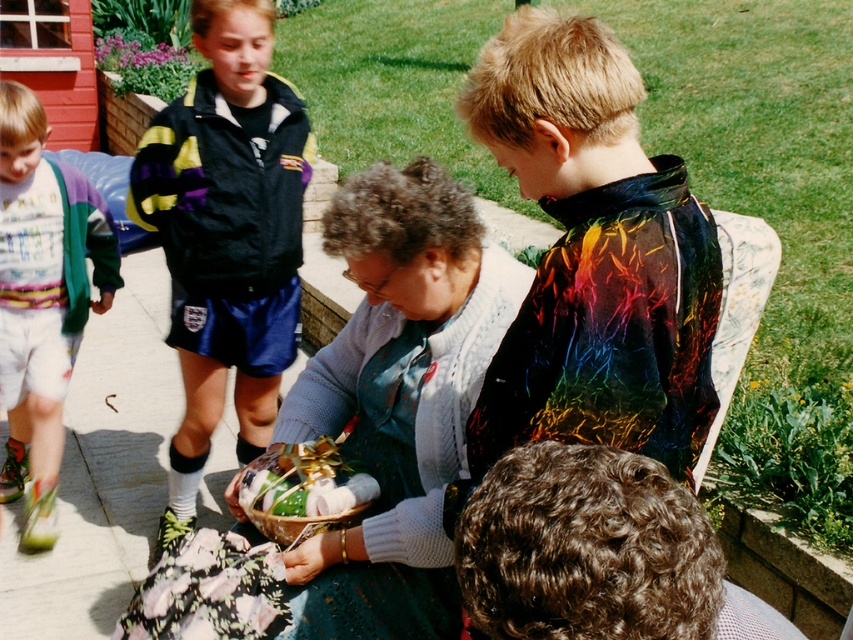
Is black jacket at upper left closer to camera compared to shiny metallic bowl at center?

No, black jacket at upper left is further to the viewer.

Which is above, black jacket at upper left or shiny metallic bowl at center?

black jacket at upper left is higher up.

Who is more distant from viewer, [173,188] or [343,504]?

Point [173,188]

Find the location of a particular element. This screenshot has height=640, width=853. black jacket at upper left is located at coordinates (225, 236).

Which is below, knitted sweater at center or multicolored fleece jacket at left?

Positioned lower is knitted sweater at center.

Who is more forward, (422, 541) or (19, 484)?

Point (422, 541) is in front.

Identify the location of knitted sweater at center. The image size is (853, 640). (398, 397).

What are the coordinates of `knitted sweater at center` in the screenshot? It's located at click(x=398, y=397).

Between point (15, 404) and point (320, 465), which one is positioned behind?

Positioned behind is point (15, 404).

Is the position of multicolored fleece jacket at left more distant than that of shiny metallic bowl at center?

Yes, it is.

Between point (42, 182) and point (281, 493), which one is positioned behind?

The point (42, 182) is behind.

You are a GUI agent. You are given a task and a screenshot of the screen. Output one action in this format:
    pyautogui.click(x=<x>, y=<y>)
    Task: Click on the multicolored fleece jacket at left
    The width and height of the screenshot is (853, 640).
    Given the screenshot: What is the action you would take?
    pyautogui.click(x=42, y=300)